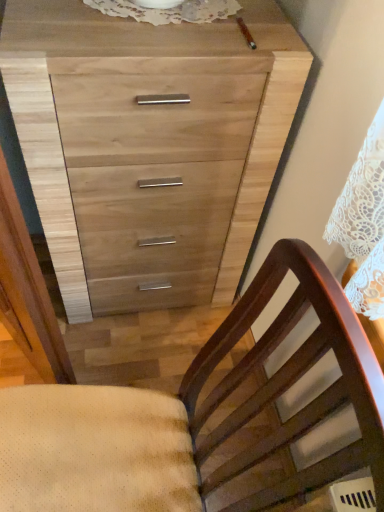
Measure the distance between natural wood chest of drawers at upper center and camera.

74.41 centimeters.

In order to face natural wood chest of drawers at upper center, should I rotate leftwards or rightwards?

To face it directly, rotate left by 5.932 degrees.

Describe the element at coordinates (149, 146) in the screenshot. I see `natural wood chest of drawers at upper center` at that location.

Find the location of a particular element. natural wood chest of drawers at upper center is located at coordinates (149, 146).

I want to click on brown wood chair at lower right, so click(x=196, y=416).

Measure the distance between brown wood chair at lower right and camera.

A distance of 14.79 inches exists between brown wood chair at lower right and camera.

The width and height of the screenshot is (384, 512). Describe the element at coordinates (196, 416) in the screenshot. I see `brown wood chair at lower right` at that location.

Looking at this image, measure the distance between point (181,392) and camera.

Point (181,392) and camera are 37.13 inches apart.

Find the location of a particular element. natural wood chest of drawers at upper center is located at coordinates (149, 146).

Which is more to the right, brown wood chair at lower right or natural wood chest of drawers at upper center?

Positioned to the right is natural wood chest of drawers at upper center.

Relative to natural wood chest of drawers at upper center, is brown wood chair at lower right in front or behind?

Clearly, brown wood chair at lower right is in front of natural wood chest of drawers at upper center.

Which point is more distant from viewer, (187, 461) or (301, 89)?

The point (301, 89) is farther.

From the image's perspective, which is above, brown wood chair at lower right or natural wood chest of drawers at upper center?

From the image's view, natural wood chest of drawers at upper center is above.

From a real-world perspective, between brown wood chair at lower right and natural wood chest of drawers at upper center, who is vertically lower?

natural wood chest of drawers at upper center, from a real-world perspective.

In the scene shown: Considering the sizes of objects brown wood chair at lower right and natural wood chest of drawers at upper center in the image provided, who is thinner, brown wood chair at lower right or natural wood chest of drawers at upper center?

natural wood chest of drawers at upper center.

In terms of height, does brown wood chair at lower right look taller or shorter compared to natural wood chest of drawers at upper center?

Clearly, brown wood chair at lower right is taller compared to natural wood chest of drawers at upper center.

Can you confirm if brown wood chair at lower right is smaller than natural wood chest of drawers at upper center?

Yes.

Is brown wood chair at lower right outside of natural wood chest of drawers at upper center?

brown wood chair at lower right lies outside natural wood chest of drawers at upper center's area.

Is brown wood chair at lower right with natural wood chest of drawers at upper center?

There is a gap between brown wood chair at lower right and natural wood chest of drawers at upper center.

Is brown wood chair at lower right oriented towards natural wood chest of drawers at upper center?

No, brown wood chair at lower right is not aimed at natural wood chest of drawers at upper center.

Could you measure the distance between brown wood chair at lower right and natural wood chest of drawers at upper center?

brown wood chair at lower right and natural wood chest of drawers at upper center are 20.19 inches apart.

The height and width of the screenshot is (512, 384). Find the location of `chair that is below the natural wood chest of drawers at upper center (from the image's perspective)`. chair that is below the natural wood chest of drawers at upper center (from the image's perspective) is located at coordinates (196, 416).

Does natural wood chest of drawers at upper center appear on the right side of brown wood chair at lower right?

Correct, you'll find natural wood chest of drawers at upper center to the right of brown wood chair at lower right.

In the image, is natural wood chest of drawers at upper center positioned in front of or behind brown wood chair at lower right?

In the image, natural wood chest of drawers at upper center appears behind brown wood chair at lower right.

Considering the positions of point (81, 207) and point (317, 269), is point (81, 207) closer or farther from the camera than point (317, 269)?

Point (81, 207) appears to be farther away from the viewer than point (317, 269).

From the image's perspective, which is below, natural wood chest of drawers at upper center or brown wood chair at lower right?

brown wood chair at lower right is shown below in the image.

From a real-world perspective, is natural wood chest of drawers at upper center located beneath brown wood chair at lower right?

Yes, from a real-world perspective, natural wood chest of drawers at upper center is below brown wood chair at lower right.

Can you confirm if natural wood chest of drawers at upper center is wider than brown wood chair at lower right?

No, natural wood chest of drawers at upper center is not wider than brown wood chair at lower right.

Can you confirm if natural wood chest of drawers at upper center is shorter than brown wood chair at lower right?

Yes, natural wood chest of drawers at upper center is shorter than brown wood chair at lower right.

Considering the sizes of natural wood chest of drawers at upper center and brown wood chair at lower right in the image, is natural wood chest of drawers at upper center bigger or smaller than brown wood chair at lower right?

Clearly, natural wood chest of drawers at upper center is larger in size than brown wood chair at lower right.

Is natural wood chest of drawers at upper center inside or outside of brown wood chair at lower right?

natural wood chest of drawers at upper center cannot be found inside brown wood chair at lower right.

Based on the photo, would you say natural wood chest of drawers at upper center is a long distance from brown wood chair at lower right?

natural wood chest of drawers at upper center is actually quite close to brown wood chair at lower right.

Could you tell me if natural wood chest of drawers at upper center is facing brown wood chair at lower right?

Yes, natural wood chest of drawers at upper center is aimed at brown wood chair at lower right.

What's the angular difference between natural wood chest of drawers at upper center and brown wood chair at lower right's facing directions?

The angular difference between natural wood chest of drawers at upper center and brown wood chair at lower right is 90.1 degrees.

You are a GUI agent. You are given a task and a screenshot of the screen. Output one action in this format:
    pyautogui.click(x=<x>, y=<y>)
    Task: Click on the chair below the natural wood chest of drawers at upper center (from the image's perspective)
    This screenshot has width=384, height=512.
    Given the screenshot: What is the action you would take?
    pyautogui.click(x=196, y=416)

This screenshot has width=384, height=512. I want to click on chair located in front of the natural wood chest of drawers at upper center, so click(196, 416).

I want to click on chair on the left of natural wood chest of drawers at upper center, so click(x=196, y=416).